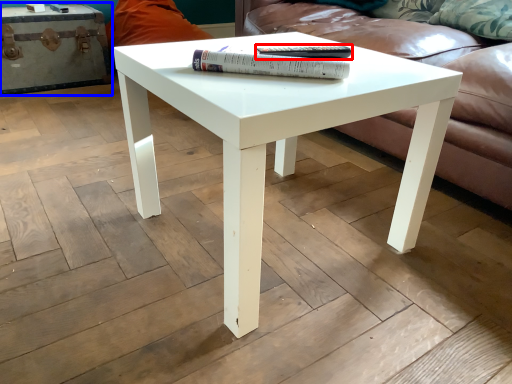
Question: Which object appears farthest to the camera in this image, paperback book (highlighted by a red box) or chest (highlighted by a blue box)?

Choices:
 (A) paperback book
 (B) chest

Answer: (B)